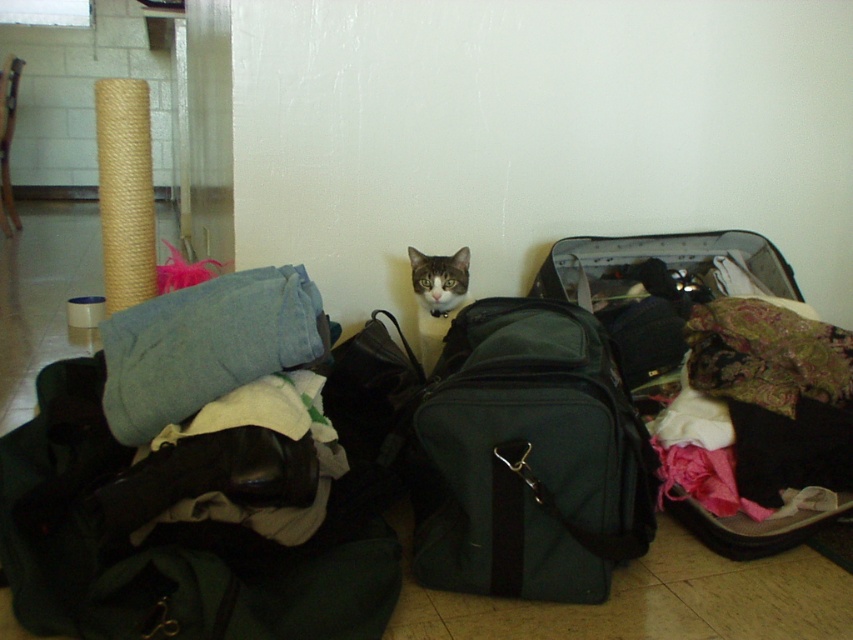
Between point (259, 372) and point (125, 224), which one is positioned in front?

Point (259, 372) is more forward.

The height and width of the screenshot is (640, 853). I want to click on denim fabric at center, so click(206, 346).

Which is behind, point (247, 356) or point (114, 116)?

The point (114, 116) is behind.

Locate an element on the screen. The image size is (853, 640). denim fabric at center is located at coordinates 206,346.

Is sisal rope scratching post at upper left taller than tabby fur cat at center?

Yes, sisal rope scratching post at upper left is taller than tabby fur cat at center.

Is sisal rope scratching post at upper left shorter than tabby fur cat at center?

No, sisal rope scratching post at upper left is not shorter than tabby fur cat at center.

Does point (142, 195) come behind point (436, 285)?

Yes, it is behind point (436, 285).

The width and height of the screenshot is (853, 640). In order to click on sisal rope scratching post at upper left in this screenshot , I will do `click(125, 192)`.

The image size is (853, 640). Describe the element at coordinates (527, 458) in the screenshot. I see `matte black backpack at center` at that location.

Which of these two, matte black backpack at center or translucent plastic suitcase at center, stands taller?

matte black backpack at center

The image size is (853, 640). I want to click on matte black backpack at center, so [527, 458].